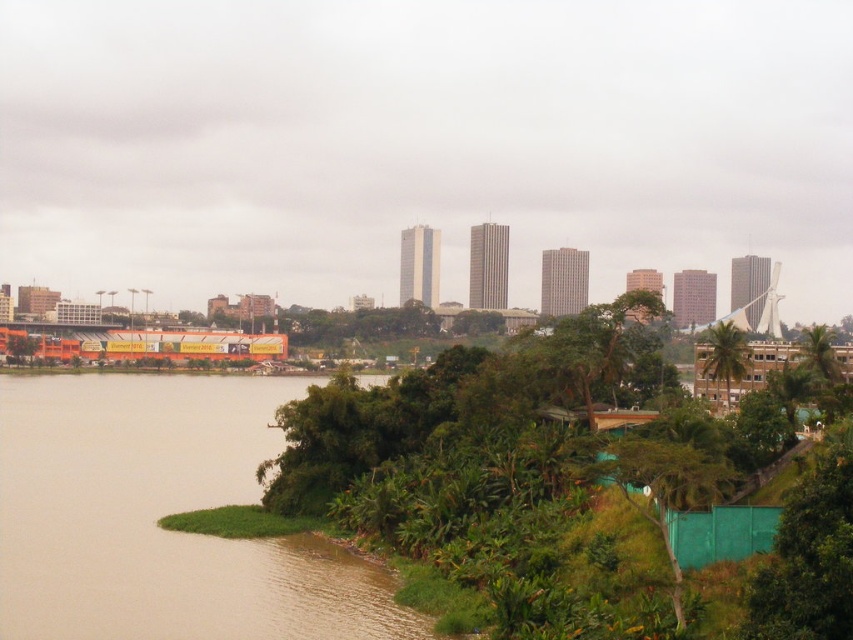
Is brown sedimentary river at lower left to the left of green leafy tree at center-right from the viewer's perspective?

Correct, you'll find brown sedimentary river at lower left to the left of green leafy tree at center-right.

Can you confirm if brown sedimentary river at lower left is smaller than green leafy tree at center-right?

Actually, brown sedimentary river at lower left might be larger than green leafy tree at center-right.

Does point (49, 612) come farther from viewer compared to point (732, 324)?

No, (49, 612) is closer to viewer.

At what (x,y) coordinates should I click in order to perform the action: click on brown sedimentary river at lower left. Please return your answer as a coordinate pair (x, y). The width and height of the screenshot is (853, 640). Looking at the image, I should click on (161, 515).

You are a GUI agent. You are given a task and a screenshot of the screen. Output one action in this format:
    pyautogui.click(x=<x>, y=<y>)
    Task: Click on the brown sedimentary river at lower left
    The height and width of the screenshot is (640, 853).
    Given the screenshot: What is the action you would take?
    pyautogui.click(x=161, y=515)

Does brown sedimentary river at lower left have a lesser height compared to green leafy tree at center?

Correct, brown sedimentary river at lower left is not as tall as green leafy tree at center.

This screenshot has height=640, width=853. Find the location of `brown sedimentary river at lower left`. brown sedimentary river at lower left is located at coordinates (161, 515).

Is green leafy tree at center wider than green leafy tree at center-right?

Indeed, green leafy tree at center has a greater width compared to green leafy tree at center-right.

Is green leafy tree at center below green leafy tree at center-right?

Yes.

Who is more forward, (485, 416) or (705, 378)?

Positioned in front is point (485, 416).

At what (x,y) coordinates should I click in order to perform the action: click on green leafy tree at center. Please return your answer as a coordinate pair (x, y). The height and width of the screenshot is (640, 853). Looking at the image, I should click on (451, 435).